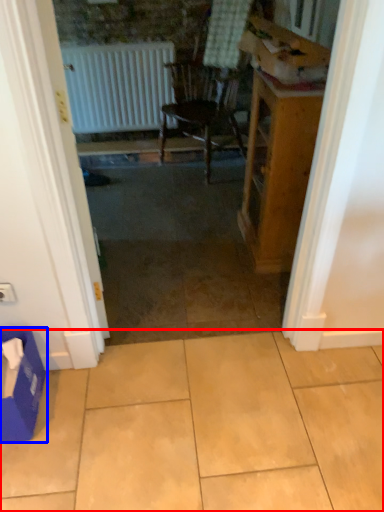
Question: Among these objects, which one is nearest to the camera, ceramic tile (highlighted by a red box) or cardboard box (highlighted by a blue box)?

Choices:
 (A) ceramic tile
 (B) cardboard box

Answer: (A)